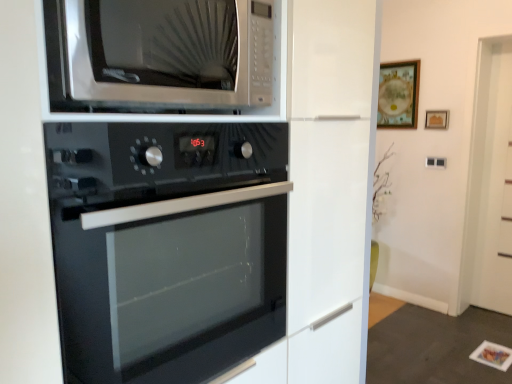
Find the location of a particular element. The width and height of the screenshot is (512, 384). wooden frame at upper center, acting as the second picture frame starting from the left is located at coordinates tap(437, 119).

Locate an element on the screen. This screenshot has width=512, height=384. white glossy door at right is located at coordinates (490, 179).

This screenshot has height=384, width=512. In order to click on wooden framed picture at upper right, the 1th picture frame viewed from the left in this screenshot , I will do `click(398, 94)`.

Does white glossy door at right appear on the right side of wooden frame at upper center, acting as the second picture frame starting from the left?

Indeed, white glossy door at right is positioned on the right side of wooden frame at upper center, acting as the second picture frame starting from the left.

From the image's perspective, is white glossy door at right above or below wooden frame at upper center, acting as the second picture frame starting from the left?

white glossy door at right is below wooden frame at upper center, acting as the second picture frame starting from the left.

Is white glossy door at right facing towards wooden frame at upper center, which is the first picture frame in right-to-left order?

No, white glossy door at right is not oriented towards wooden frame at upper center, which is the first picture frame in right-to-left order.

Is wooden frame at upper center, which is the first picture frame in right-to-left order, inside white glossy door at right?

No, wooden frame at upper center, which is the first picture frame in right-to-left order, is not surrounded by white glossy door at right.

Is point (86, 142) positioned in front of point (167, 83)?

That is True.

At what (x,y) coordinates should I click in order to perform the action: click on microwave oven that appears in front of the black glass oven at center. Please return your answer as a coordinate pair (x, y). Image resolution: width=512 pixels, height=384 pixels. Looking at the image, I should click on (159, 54).

Can satin silver microwave at upper center be found inside black glass oven at center?

No.

From the image's perspective, is black glass oven at center located above or below satin silver microwave at upper center?

From the image's perspective, black glass oven at center appears below satin silver microwave at upper center.

Visually, is wooden framed picture at upper right, the 1th picture frame viewed from the left, positioned to the left or to the right of black glass oven at center?

wooden framed picture at upper right, the 1th picture frame viewed from the left, is to the right of black glass oven at center.

Between point (396, 75) and point (231, 208), which one is positioned in front?

The point (231, 208) is closer.

Does wooden framed picture at upper right, the 1th picture frame viewed from the left, lie behind black glass oven at center?

Yes, it is behind black glass oven at center.

Is wooden framed picture at upper right, the 2th picture frame when ordered from right to left, next to black glass oven at center?

No, wooden framed picture at upper right, the 2th picture frame when ordered from right to left, is not touching black glass oven at center.

Considering the relative sizes of wooden framed picture at upper right, the 2th picture frame when ordered from right to left, and satin silver microwave at upper center in the image provided, is wooden framed picture at upper right, the 2th picture frame when ordered from right to left, shorter than satin silver microwave at upper center?

Incorrect, the height of wooden framed picture at upper right, the 2th picture frame when ordered from right to left, does not fall short of that of satin silver microwave at upper center.

Considering the positions of objects wooden framed picture at upper right, the 1th picture frame viewed from the left, and satin silver microwave at upper center in the image provided, who is behind, wooden framed picture at upper right, the 1th picture frame viewed from the left, or satin silver microwave at upper center?

Positioned behind is wooden framed picture at upper right, the 1th picture frame viewed from the left.

Considering the relative sizes of wooden framed picture at upper right, the 2th picture frame when ordered from right to left, and satin silver microwave at upper center in the image provided, is wooden framed picture at upper right, the 2th picture frame when ordered from right to left, bigger than satin silver microwave at upper center?

No.

Which picture frame is the 1st one when counting from the right side of the satin silver microwave at upper center? Please provide its 2D coordinates.

[(398, 94)]

Are satin silver microwave at upper center and wooden framed picture at upper right, the 2th picture frame when ordered from right to left, beside each other?

No, satin silver microwave at upper center is not with wooden framed picture at upper right, the 2th picture frame when ordered from right to left.

Is satin silver microwave at upper center bigger than wooden framed picture at upper right, the 2th picture frame when ordered from right to left?

Indeed, satin silver microwave at upper center has a larger size compared to wooden framed picture at upper right, the 2th picture frame when ordered from right to left.

Considering the relative sizes of satin silver microwave at upper center and wooden framed picture at upper right, the 1th picture frame viewed from the left, in the image provided, is satin silver microwave at upper center taller than wooden framed picture at upper right, the 1th picture frame viewed from the left,?

In fact, satin silver microwave at upper center may be shorter than wooden framed picture at upper right, the 1th picture frame viewed from the left.

From the image's perspective, which object appears higher, satin silver microwave at upper center or wooden frame at upper center, which is the first picture frame in right-to-left order?

wooden frame at upper center, which is the first picture frame in right-to-left order, is shown above in the image.

From the image's perspective, count 1st picture frames upward from the satin silver microwave at upper center and point to it. Please provide its 2D coordinates.

[(437, 119)]

Which is in front, point (122, 66) or point (443, 120)?

Point (122, 66)

Looking at this image, how far apart are satin silver microwave at upper center and wooden frame at upper center, acting as the second picture frame starting from the left?

The distance of satin silver microwave at upper center from wooden frame at upper center, acting as the second picture frame starting from the left, is 9.05 feet.

Is black glass oven at center completely or partially inside white glossy door at right?

No, white glossy door at right does not contain black glass oven at center.

From the image's perspective, which object appears higher, white glossy door at right or black glass oven at center?

white glossy door at right, from the image's perspective.

Is white glossy door at right oriented away from black glass oven at center?

No, white glossy door at right is not facing away from black glass oven at center.

The width and height of the screenshot is (512, 384). I want to click on glass door lying in front of the wooden frame at upper center, which is the first picture frame in right-to-left order, so click(490, 179).

This screenshot has width=512, height=384. Identify the location of oven located underneath the satin silver microwave at upper center (from a real-world perspective). (167, 246).

Estimate the real-world distances between objects in this image. Which object is further from black glass oven at center, satin silver microwave at upper center or white glossy door at right?

white glossy door at right is positioned further to the anchor black glass oven at center.

Based on their spatial positions, is black glass oven at center or satin silver microwave at upper center further from white glossy door at right?

satin silver microwave at upper center.

Which object lies nearer to the anchor point white glossy door at right, wooden framed picture at upper right, the 2th picture frame when ordered from right to left, or satin silver microwave at upper center?

Based on the image, wooden framed picture at upper right, the 2th picture frame when ordered from right to left, appears to be nearer to white glossy door at right.

Which object lies further to the anchor point wooden frame at upper center, which is the first picture frame in right-to-left order, satin silver microwave at upper center or black glass oven at center?

Among the two, satin silver microwave at upper center is located further to wooden frame at upper center, which is the first picture frame in right-to-left order.

When comparing their distances from white glossy door at right, does satin silver microwave at upper center or black glass oven at center seem further?

satin silver microwave at upper center lies further to white glossy door at right than the other object.

Considering their positions, is wooden frame at upper center, acting as the second picture frame starting from the left, positioned closer to white glossy door at right than wooden framed picture at upper right, the 2th picture frame when ordered from right to left?

Among the two, wooden frame at upper center, acting as the second picture frame starting from the left, is located nearer to white glossy door at right.

Estimate the real-world distances between objects in this image. Which object is further from black glass oven at center, white glossy door at right or wooden framed picture at upper right, the 1th picture frame viewed from the left?

white glossy door at right is positioned further to the anchor black glass oven at center.

From the picture: When comparing their distances from satin silver microwave at upper center, does white glossy door at right or wooden frame at upper center, acting as the second picture frame starting from the left, seem closer?

Based on the image, wooden frame at upper center, acting as the second picture frame starting from the left, appears to be nearer to satin silver microwave at upper center.

Find the location of a particular element. The width and height of the screenshot is (512, 384). glass door positioned between satin silver microwave at upper center and wooden framed picture at upper right, the 2th picture frame when ordered from right to left, from near to far is located at coordinates (490, 179).

This screenshot has width=512, height=384. Find the location of `oven located between satin silver microwave at upper center and white glossy door at right in the depth direction`. oven located between satin silver microwave at upper center and white glossy door at right in the depth direction is located at coordinates (167, 246).

Image resolution: width=512 pixels, height=384 pixels. Find the location of `picture frame between satin silver microwave at upper center and wooden framed picture at upper right, the 2th picture frame when ordered from right to left, along the z-axis`. picture frame between satin silver microwave at upper center and wooden framed picture at upper right, the 2th picture frame when ordered from right to left, along the z-axis is located at coordinates (437, 119).

The image size is (512, 384). I want to click on glass door between black glass oven at center and wooden framed picture at upper right, the 1th picture frame viewed from the left, in the front-back direction, so click(490, 179).